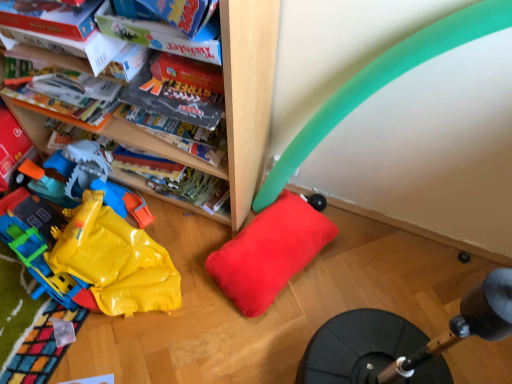
Question: In terms of width, does matte cardboard book at upper left look wider or thinner when compared to soft red pillow at center?

Choices:
 (A) wide
 (B) thin

Answer: (B)

Question: Relative to soft red pillow at center, is matte cardboard book at upper left in front or behind?

Choices:
 (A) front
 (B) behind

Answer: (A)

Question: Estimate the real-world distances between objects in this image. Which object is farther from the yellow plastic bag at lower left?

Choices:
 (A) matte cardboard book at upper left
 (B) soft red pillow at center

Answer: (A)

Question: Estimate the real-world distances between objects in this image. Which object is farther from the yellow plastic bag at lower left?

Choices:
 (A) matte cardboard book at upper left
 (B) soft red pillow at center

Answer: (A)